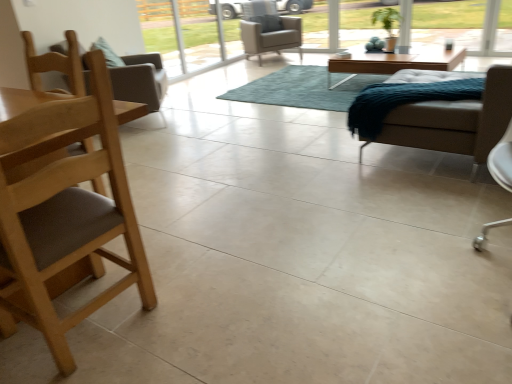
Where is `light brown leather armchair at center, the fourth chair from the front`? The width and height of the screenshot is (512, 384). light brown leather armchair at center, the fourth chair from the front is located at coordinates click(268, 30).

Measure the distance between light brown leather armchair at center, the 1th chair when ordered from back to front, and camera.

They are 19.02 feet apart.

Describe the element at coordinates (395, 62) in the screenshot. I see `light brown wooden coffee table at center` at that location.

At what (x,y) coordinates should I click in order to perform the action: click on transparent glass screen door at upper center. Please return your answer as a coordinate pair (x, y). The width and height of the screenshot is (512, 384). Looking at the image, I should click on (181, 34).

This screenshot has height=384, width=512. Describe the element at coordinates (66, 216) in the screenshot. I see `brown wood chair at left, marked as the first chair in a front-to-back arrangement` at that location.

Describe the element at coordinates (140, 80) in the screenshot. I see `wooden chair at left, acting as the 3th chair starting from the bottom` at that location.

The width and height of the screenshot is (512, 384). What are the coordinates of `wooden chair at left, acting as the 3th chair starting from the bottom` in the screenshot? It's located at (140, 80).

What do you see at coordinates (454, 122) in the screenshot? I see `white leather chair at right, arranged as the 3th chair when viewed from the top` at bounding box center [454, 122].

You are a GUI agent. You are given a task and a screenshot of the screen. Output one action in this format:
    pyautogui.click(x=<x>, y=<y>)
    Task: Click on the teal shaggy rug at center
    Image resolution: width=512 pixels, height=384 pixels.
    Given the screenshot: What is the action you would take?
    pyautogui.click(x=302, y=89)

Find the location of `the 2nd chair below the teal shaggy rug at center (from the image's perspective)`. the 2nd chair below the teal shaggy rug at center (from the image's perspective) is located at coordinates (454, 122).

Does teal shaggy rug at center have a lesser height compared to white leather chair at right, which appears as the third chair when viewed from the back?

Indeed, teal shaggy rug at center has a lesser height compared to white leather chair at right, which appears as the third chair when viewed from the back.

Can you confirm if teal shaggy rug at center is positioned to the left of white leather chair at right, which appears as the third chair when viewed from the back?

Yes, teal shaggy rug at center is to the left of white leather chair at right, which appears as the third chair when viewed from the back.

Considering the sizes of teal shaggy rug at center and white leather chair at right, which is the 2th chair in bottom-to-top order, in the image, is teal shaggy rug at center bigger or smaller than white leather chair at right, which is the 2th chair in bottom-to-top order,?

Considering their sizes, teal shaggy rug at center takes up more space than white leather chair at right, which is the 2th chair in bottom-to-top order.

From a real-world perspective, is white leather chair at right, which is the 2th chair in bottom-to-top order, on teal shaggy rug at center?

Yes, from a real-world perspective, white leather chair at right, which is the 2th chair in bottom-to-top order, is over teal shaggy rug at center

Which chair is the 2nd one when counting from the front of the teal shaggy rug at center? Please provide its 2D coordinates.

[(454, 122)]

Is white leather chair at right, which appears as the third chair when viewed from the back, aimed at teal shaggy rug at center?

No, white leather chair at right, which appears as the third chair when viewed from the back, is not turned towards teal shaggy rug at center.

Which of these two, white leather chair at right, which appears as the 2th chair when viewed from the front, or teal shaggy rug at center, stands shorter?

teal shaggy rug at center.

Do you think teal shaggy rug at center is within transparent glass screen door at upper center, or outside of it?

teal shaggy rug at center is not inside transparent glass screen door at upper center, it's outside.

Considering the sizes of teal shaggy rug at center and transparent glass screen door at upper center in the image, is teal shaggy rug at center wider or thinner than transparent glass screen door at upper center?

Clearly, teal shaggy rug at center has more width compared to transparent glass screen door at upper center.

From a real-world perspective, between teal shaggy rug at center and transparent glass screen door at upper center, who is vertically lower?

In real-world perspective, teal shaggy rug at center is lower.

Could you tell me if teal shaggy rug at center is facing transparent glass screen door at upper center?

No, teal shaggy rug at center is not oriented towards transparent glass screen door at upper center.

Could you tell me if transparent glass screen door at upper center is turned towards brown wood chair at left, marked as the first chair in a front-to-back arrangement?

No, transparent glass screen door at upper center is not turned towards brown wood chair at left, marked as the first chair in a front-to-back arrangement.

Relative to brown wood chair at left, which appears as the 4th chair when viewed from the back, is transparent glass screen door at upper center in front or behind?

Clearly, transparent glass screen door at upper center is behind brown wood chair at left, which appears as the 4th chair when viewed from the back.

Is brown wood chair at left, which appears as the 4th chair when viewed from the back, located within transparent glass screen door at upper center?

No, brown wood chair at left, which appears as the 4th chair when viewed from the back, is not surrounded by transparent glass screen door at upper center.

Can you confirm if brown wood chair at left, marked as the 4th chair in a top-to-bottom arrangement, is smaller than white leather chair at right, which appears as the third chair when viewed from the back?

Incorrect, brown wood chair at left, marked as the 4th chair in a top-to-bottom arrangement, is not smaller in size than white leather chair at right, which appears as the third chair when viewed from the back.

Considering the relative positions of brown wood chair at left, marked as the first chair in a front-to-back arrangement, and white leather chair at right, which appears as the third chair when viewed from the back, in the image provided, is brown wood chair at left, marked as the first chair in a front-to-back arrangement, in front of white leather chair at right, which appears as the third chair when viewed from the back,?

Yes, brown wood chair at left, marked as the first chair in a front-to-back arrangement, is closer to the camera.

How many degrees apart are the facing directions of brown wood chair at left, which is the first chair in bottom-to-top order, and white leather chair at right, which is the 2th chair in bottom-to-top order?

brown wood chair at left, which is the first chair in bottom-to-top order, and white leather chair at right, which is the 2th chair in bottom-to-top order, are facing 119 degrees away from each other.

Is brown wood chair at left, which appears as the 4th chair when viewed from the back, outside of white leather chair at right, which appears as the 2th chair when viewed from the front?

Indeed, brown wood chair at left, which appears as the 4th chair when viewed from the back, is completely outside white leather chair at right, which appears as the 2th chair when viewed from the front.

Who is smaller, wooden chair at left, acting as the 3th chair starting from the bottom, or teal shaggy rug at center?

With smaller size is teal shaggy rug at center.

Is wooden chair at left, marked as the 3th chair in a front-to-back arrangement, oriented towards teal shaggy rug at center?

Yes, wooden chair at left, marked as the 3th chair in a front-to-back arrangement, is facing teal shaggy rug at center.

From their relative heights in the image, would you say wooden chair at left, marked as the 3th chair in a front-to-back arrangement, is taller or shorter than teal shaggy rug at center?

Considering their sizes, wooden chair at left, marked as the 3th chair in a front-to-back arrangement, has more height than teal shaggy rug at center.

Can you confirm if wooden chair at left, the 2th chair in the top-to-bottom sequence, is positioned to the left of teal shaggy rug at center?

Correct, you'll find wooden chair at left, the 2th chair in the top-to-bottom sequence, to the left of teal shaggy rug at center.

Who is smaller, wooden chair at left, acting as the 3th chair starting from the bottom, or brown wood chair at left, marked as the 4th chair in a top-to-bottom arrangement?

Smaller between the two is wooden chair at left, acting as the 3th chair starting from the bottom.

Considering the relative sizes of wooden chair at left, marked as the 3th chair in a front-to-back arrangement, and brown wood chair at left, marked as the first chair in a front-to-back arrangement, in the image provided, is wooden chair at left, marked as the 3th chair in a front-to-back arrangement, wider than brown wood chair at left, marked as the first chair in a front-to-back arrangement,?

Correct, the width of wooden chair at left, marked as the 3th chair in a front-to-back arrangement, exceeds that of brown wood chair at left, marked as the first chair in a front-to-back arrangement.

Is wooden chair at left, the 2th chair in the top-to-bottom sequence, oriented towards brown wood chair at left, which is the first chair in bottom-to-top order?

No, wooden chair at left, the 2th chair in the top-to-bottom sequence, is not turned towards brown wood chair at left, which is the first chair in bottom-to-top order.

At what (x,y) coordinates should I click in order to perform the action: click on mat on the left of white leather chair at right, which appears as the third chair when viewed from the back. Please return your answer as a coordinate pair (x, y). Image resolution: width=512 pixels, height=384 pixels. Looking at the image, I should click on click(302, 89).

There is a teal shaggy rug at center. Where is `the 1st chair above it (from a real-world perspective)`? The width and height of the screenshot is (512, 384). the 1st chair above it (from a real-world perspective) is located at coordinates (454, 122).

Looking at this image, when comparing their distances from white leather chair at right, which is the 2th chair in bottom-to-top order, does light brown leather armchair at center, the fourth chair ordered from the bottom, or wooden chair at left, the 2th chair in the back-to-front sequence, seem closer?

Based on the image, wooden chair at left, the 2th chair in the back-to-front sequence, appears to be nearer to white leather chair at right, which is the 2th chair in bottom-to-top order.

From the image, which object appears to be nearer to brown wood chair at left, marked as the first chair in a front-to-back arrangement, light brown leather armchair at center, which is the first chair in top-to-bottom order, or wooden chair at left, acting as the 3th chair starting from the bottom?

Among the two, wooden chair at left, acting as the 3th chair starting from the bottom, is located nearer to brown wood chair at left, marked as the first chair in a front-to-back arrangement.

Estimate the real-world distances between objects in this image. Which object is closer to transparent glass screen door at upper center, brown wood chair at left, which is the first chair in bottom-to-top order, or light brown wooden coffee table at center?

light brown wooden coffee table at center lies closer to transparent glass screen door at upper center than the other object.

From the image, which object appears to be nearer to light brown wooden coffee table at center, brown wood chair at left, which is the first chair in bottom-to-top order, or teal shaggy rug at center?

The object closer to light brown wooden coffee table at center is teal shaggy rug at center.

Looking at this image, based on their spatial positions, is light brown wooden coffee table at center or transparent glass screen door at upper center closer to light brown leather armchair at center, which is the first chair in top-to-bottom order?

Based on the image, light brown wooden coffee table at center appears to be nearer to light brown leather armchair at center, which is the first chair in top-to-bottom order.

Which object lies nearer to the anchor point brown wood chair at left, marked as the 4th chair in a top-to-bottom arrangement, light brown leather armchair at center, the 1th chair when ordered from back to front, or transparent glass screen door at upper center?

Among the two, light brown leather armchair at center, the 1th chair when ordered from back to front, is located nearer to brown wood chair at left, marked as the 4th chair in a top-to-bottom arrangement.

When comparing their distances from light brown leather armchair at center, the 1th chair when ordered from back to front, does white leather chair at right, which appears as the third chair when viewed from the back, or wooden chair at left, acting as the 3th chair starting from the bottom, seem further?

white leather chair at right, which appears as the third chair when viewed from the back, is further to light brown leather armchair at center, the 1th chair when ordered from back to front.

Which object lies further to the anchor point transparent glass screen door at upper center, brown wood chair at left, marked as the first chair in a front-to-back arrangement, or light brown leather armchair at center, the fourth chair ordered from the bottom?

brown wood chair at left, marked as the first chair in a front-to-back arrangement, is further to transparent glass screen door at upper center.

Where is `mat positioned between white leather chair at right, which appears as the third chair when viewed from the back, and transparent glass screen door at upper center from near to far`? The image size is (512, 384). mat positioned between white leather chair at right, which appears as the third chair when viewed from the back, and transparent glass screen door at upper center from near to far is located at coordinates (x=302, y=89).

Locate an element on the screen. Image resolution: width=512 pixels, height=384 pixels. chair located between white leather chair at right, which appears as the third chair when viewed from the back, and transparent glass screen door at upper center in the depth direction is located at coordinates (140, 80).

The image size is (512, 384). I want to click on mat between brown wood chair at left, marked as the first chair in a front-to-back arrangement, and transparent glass screen door at upper center in the front-back direction, so click(302, 89).

Locate an element on the screen. The image size is (512, 384). mat located between brown wood chair at left, marked as the 4th chair in a top-to-bottom arrangement, and light brown leather armchair at center, the fourth chair ordered from the bottom, in the depth direction is located at coordinates (302, 89).